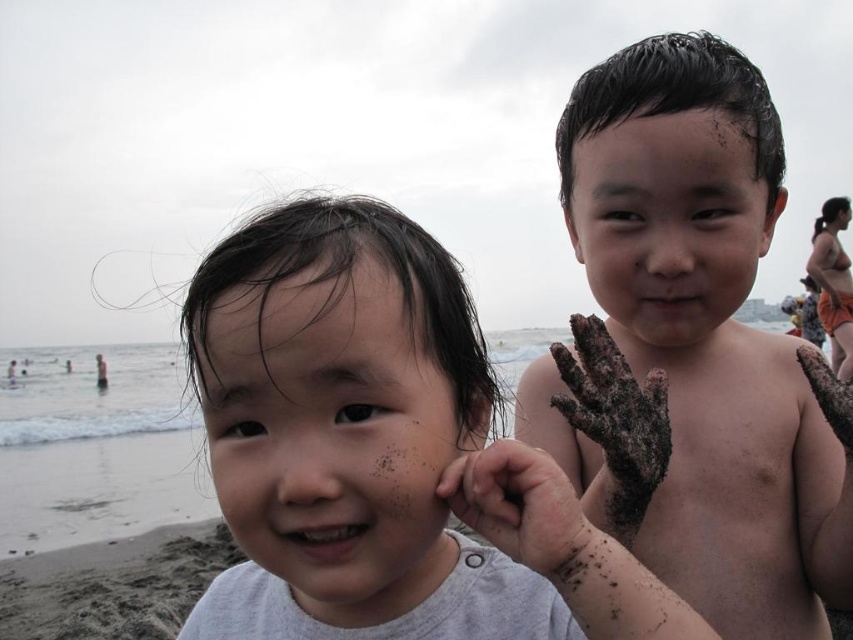
Is point (480, 468) positioned behind point (728, 108)?

No, (480, 468) is closer to viewer.

Who is more forward, (415, 496) or (671, 349)?

Point (415, 496) is in front.

The image size is (853, 640). Describe the element at coordinates (381, 451) in the screenshot. I see `smooth skin child at center` at that location.

Find the location of `smooth skin child at center`. smooth skin child at center is located at coordinates (381, 451).

Between point (422, 550) and point (158, 621), which one is positioned behind?

The point (158, 621) is more distant.

Does smooth skin face at center have a smaller size compared to brown sandy mud at lower left?

Correct, smooth skin face at center occupies less space than brown sandy mud at lower left.

The image size is (853, 640). What do you see at coordinates (331, 438) in the screenshot?
I see `smooth skin face at center` at bounding box center [331, 438].

Find the location of a particular element. smooth skin face at center is located at coordinates point(331,438).

Can you confirm if dark wet hair at upper right is taller than smooth skin face at center?

Yes.

Measure the distance from dark wet hair at upper right to smooth skin face at center.

dark wet hair at upper right and smooth skin face at center are 17.06 inches apart.

What do you see at coordinates (692, 348) in the screenshot?
I see `dark wet hair at upper right` at bounding box center [692, 348].

The width and height of the screenshot is (853, 640). Identify the location of dark wet hair at upper right. (692, 348).